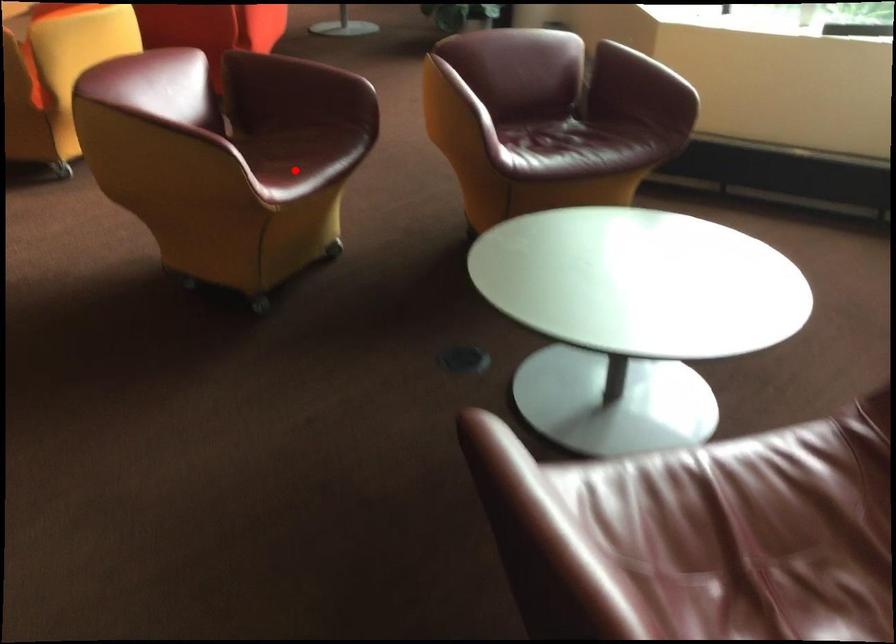
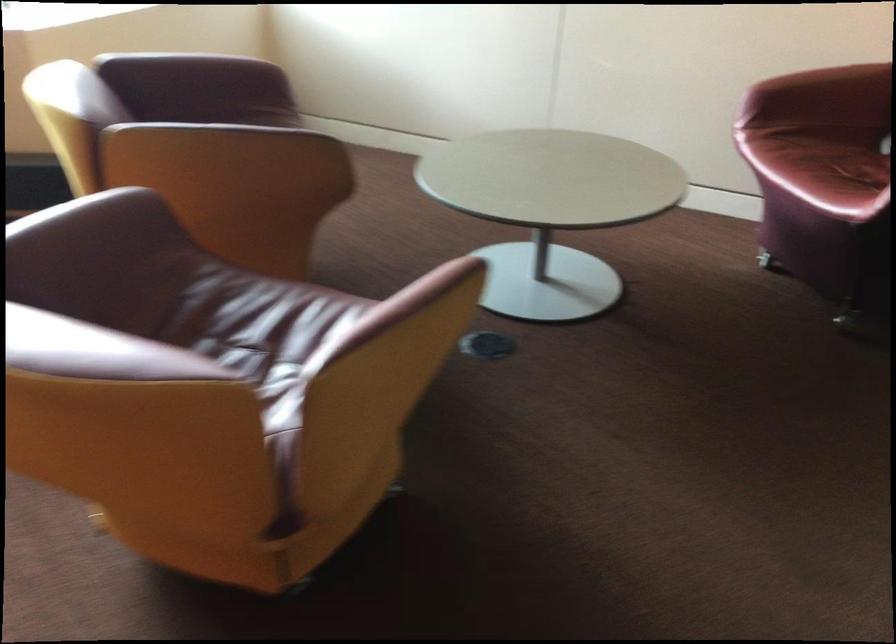
Find the pixel in the second image that matches the highlighted location in the first image.

(250, 323)